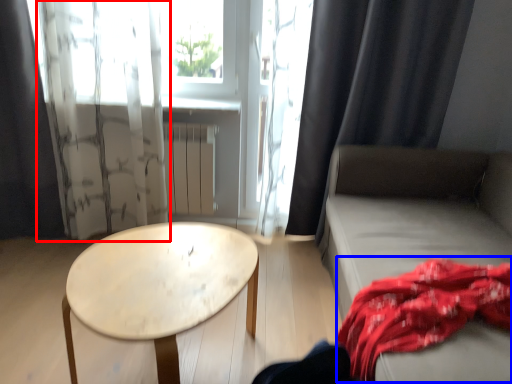
Question: Which point is closer to the camera, curtain (highlighted by a red box) or blanket (highlighted by a blue box)?

Choices:
 (A) curtain
 (B) blanket

Answer: (B)